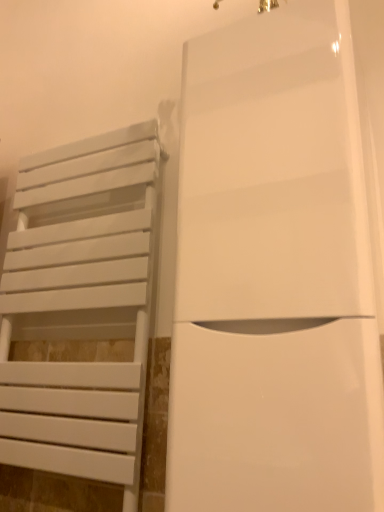
Question: Would you say white matte towel rack at left is inside or outside white glossy door at center?

Choices:
 (A) inside
 (B) outside

Answer: (B)

Question: In terms of height, does white matte towel rack at left look taller or shorter compared to white glossy door at center?

Choices:
 (A) tall
 (B) short

Answer: (A)

Question: Is point (92, 442) closer or farther from the camera than point (314, 324)?

Choices:
 (A) farther
 (B) closer

Answer: (A)

Question: Is white glossy door at center situated inside white matte towel rack at left or outside?

Choices:
 (A) outside
 (B) inside

Answer: (A)

Question: Does point (192, 432) appear closer or farther from the camera than point (28, 452)?

Choices:
 (A) closer
 (B) farther

Answer: (A)

Question: From a real-world perspective, is white glossy door at center positioned above or below white matte towel rack at left?

Choices:
 (A) below
 (B) above

Answer: (B)

Question: Considering the positions of white glossy door at center and white matte towel rack at left in the image, is white glossy door at center bigger or smaller than white matte towel rack at left?

Choices:
 (A) small
 (B) big

Answer: (B)